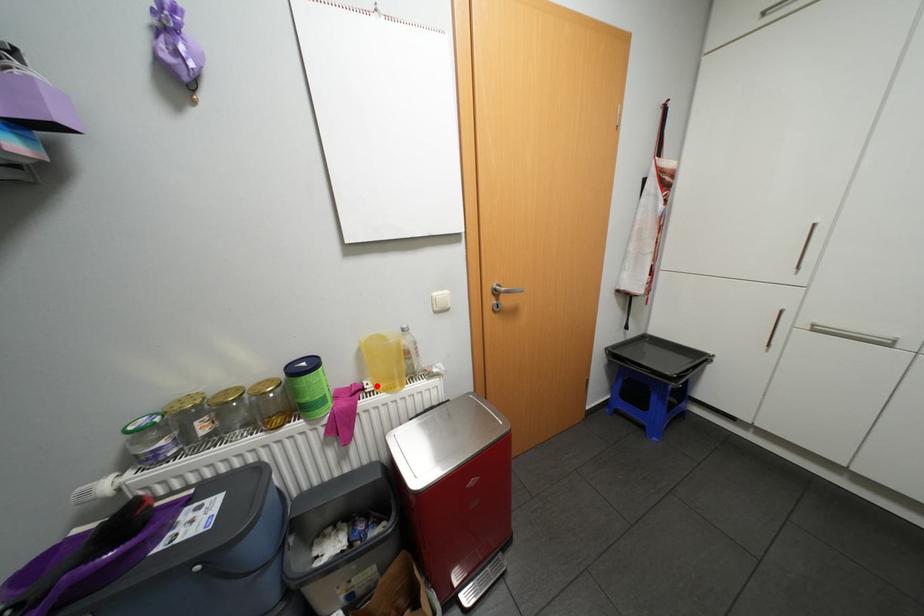
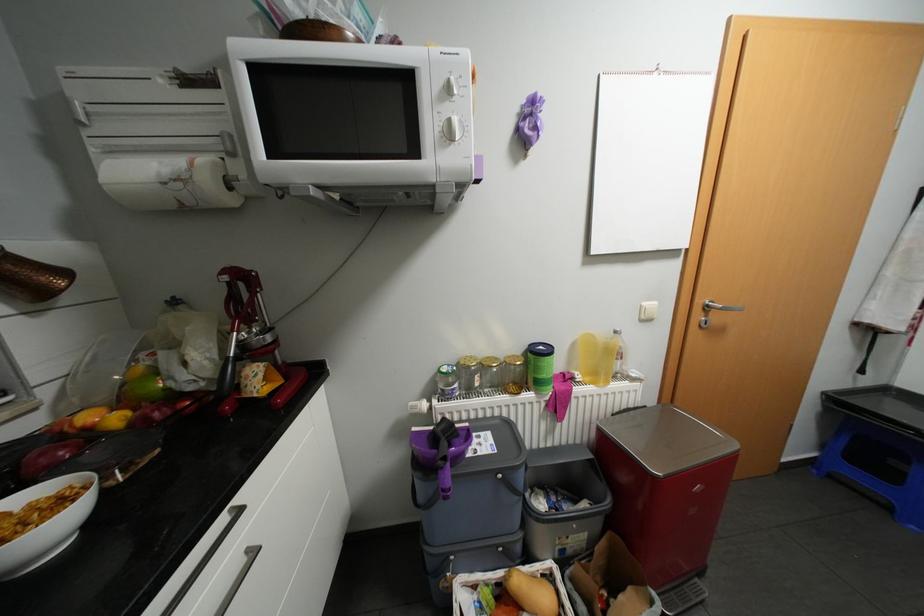
Where in the second image is the point corresponding to the highlighted location from the first image?

(587, 377)